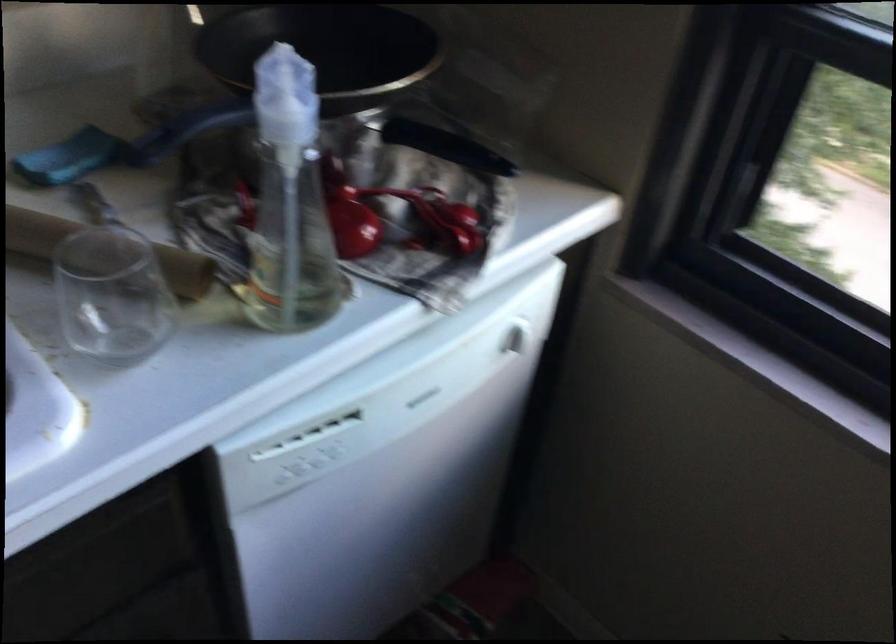
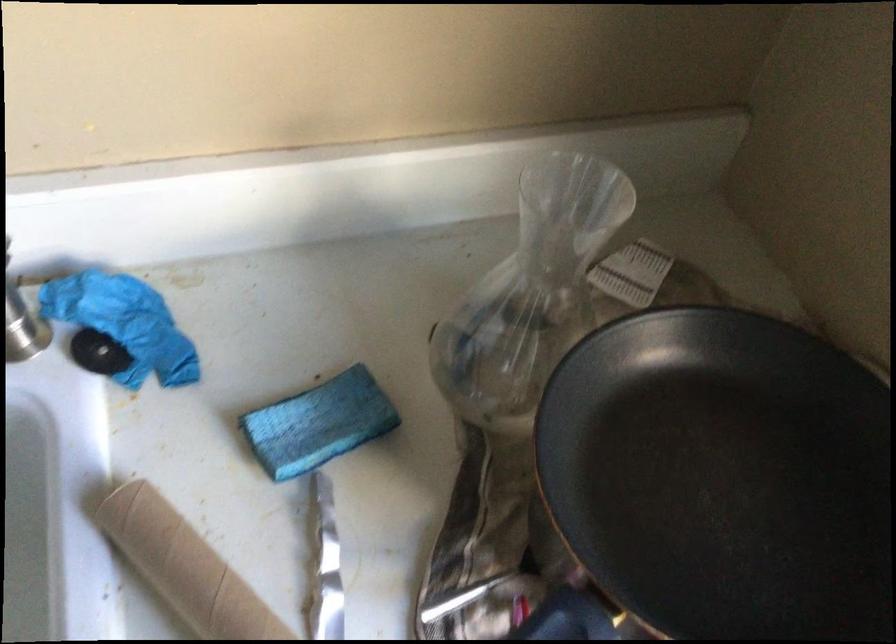
Which direction would the cameraman need to move to produce the second image?

The cameraman walked toward left, forward.